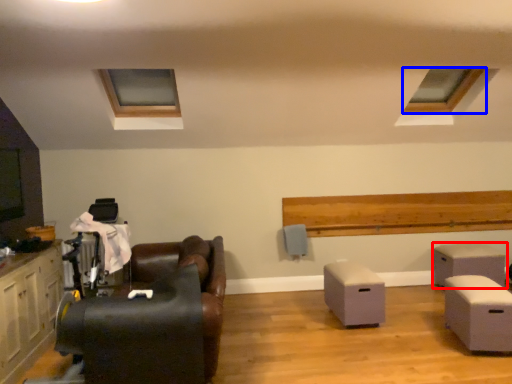
Question: Which object is closer to the camera taking this photo, table (highlighted by a red box) or window (highlighted by a blue box)?

Choices:
 (A) table
 (B) window

Answer: (B)